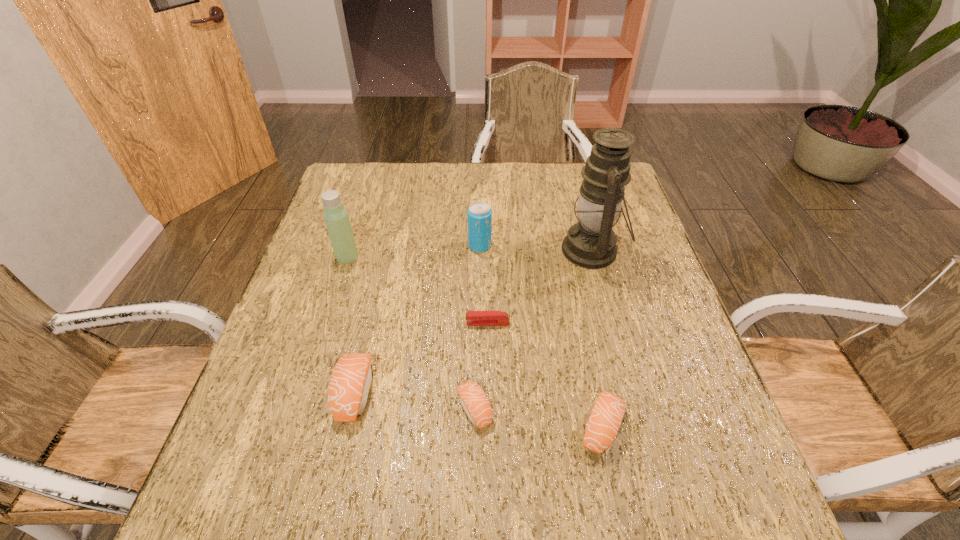
Where is `vacant space located 0.080m on the left of the leftmost sushi`? This screenshot has width=960, height=540. vacant space located 0.080m on the left of the leftmost sushi is located at coordinates (299, 393).

Locate an element on the screen. This screenshot has width=960, height=540. vacant space located on the back of the second sushi from right to left is located at coordinates (475, 260).

The image size is (960, 540). Find the location of `free location located on the left of the third shortest object`. free location located on the left of the third shortest object is located at coordinates (482, 427).

The width and height of the screenshot is (960, 540). Identify the location of blank space located 0.360m on the left of the oil lamp. (428, 251).

Identify the location of free region located on the back of the thermos bottle. The image size is (960, 540). (372, 180).

The width and height of the screenshot is (960, 540). Identify the location of free space located on the back of the third tallest object. (480, 197).

Where is `vacant space situated 0.130m on the front-facing side of the stapler`? vacant space situated 0.130m on the front-facing side of the stapler is located at coordinates (410, 323).

Identify the location of free space located 0.060m on the front-facing side of the stapler. Image resolution: width=960 pixels, height=540 pixels. (440, 323).

The height and width of the screenshot is (540, 960). Find the location of `free space located on the front-facing side of the stapler`. free space located on the front-facing side of the stapler is located at coordinates pos(366,323).

Locate an element on the screen. Image resolution: width=960 pixels, height=540 pixels. object at the left edge is located at coordinates (337, 221).